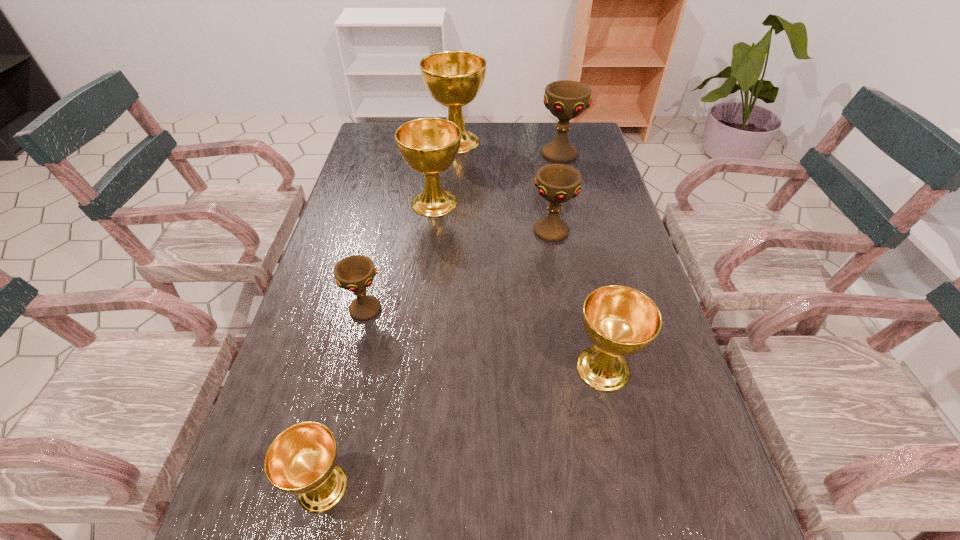
Where is `free space at the left edge of the desktop`? free space at the left edge of the desktop is located at coordinates (364, 256).

Locate an element on the screen. The image size is (960, 540). vacant area at the right edge is located at coordinates (588, 161).

Identify the location of blank area at the far right corner. (586, 122).

You are a GUI agent. You are given a task and a screenshot of the screen. Output one action in this format:
    pyautogui.click(x=<x>, y=<y>)
    Task: Click on the empty space between the second smallest gold chalice and the farthest red chalice
    This screenshot has height=540, width=960.
    Given the screenshot: What is the action you would take?
    pyautogui.click(x=581, y=261)

You are a GUI agent. You are given a task and a screenshot of the screen. Output one action in this format:
    pyautogui.click(x=<x>, y=<y>)
    Task: Click on the free spot between the nearest object and the biggest red chalice
    This screenshot has height=540, width=960.
    Given the screenshot: What is the action you would take?
    pyautogui.click(x=441, y=321)

Locate an element on the screen. This screenshot has width=960, height=540. free space between the second farthest gold chalice and the farthest gold chalice is located at coordinates (445, 172).

The height and width of the screenshot is (540, 960). I want to click on vacant space that's between the biggest red chalice and the second nearest gold chalice, so click(x=581, y=261).

Identify the location of free spot between the farthest red chalice and the tallest chalice. The height and width of the screenshot is (540, 960). (508, 148).

Identify the location of free point between the smallest gold chalice and the second nearest red chalice. (437, 359).

What are the coordinates of `free area in between the rightmost gold chalice and the biggest red chalice` in the screenshot? It's located at (581, 261).